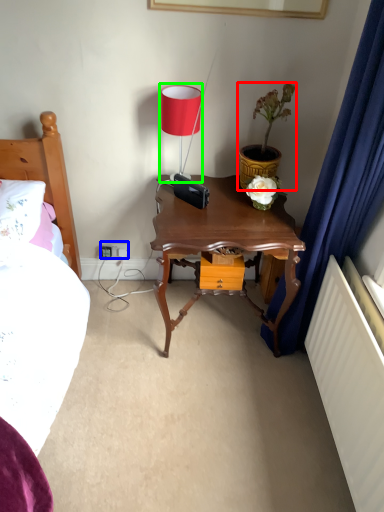
Question: Which object is positioned closest to houseplant (highlighted by a red box)? Select from electric outlet (highlighted by a blue box) and table lamp (highlighted by a green box).

Choices:
 (A) electric outlet
 (B) table lamp

Answer: (B)